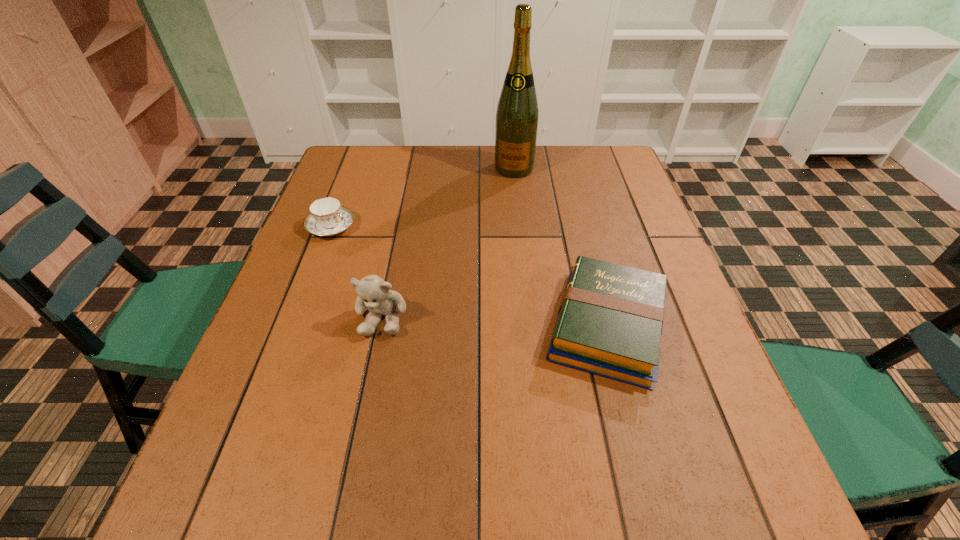
The image size is (960, 540). Identify the location of vacant space that satisfies the following two spatial constraints: 1. on the front side of the book; 2. on the left side of the third nearest object. (294, 326).

Identify the location of blank area in the image that satisfies the following two spatial constraints: 1. on the face of the book; 2. on the left side of the second tallest object. (380, 326).

Identify the location of free point that satisfies the following two spatial constraints: 1. on the front side of the teacup; 2. on the right side of the book. Image resolution: width=960 pixels, height=540 pixels. click(x=294, y=326).